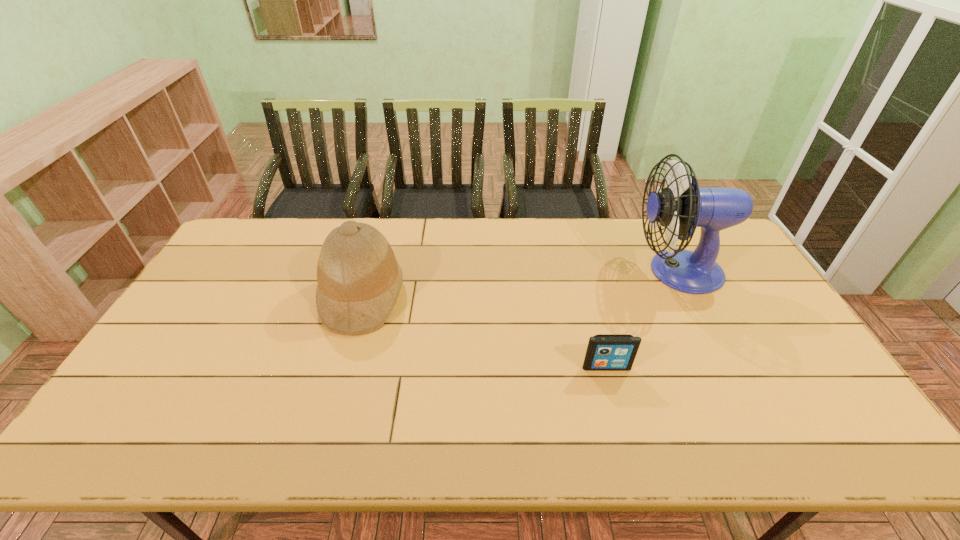
This screenshot has height=540, width=960. I want to click on free spot between the tallest object and the nearest object, so click(x=642, y=319).

Find the location of a particular element. vacant region between the hat and the nearest object is located at coordinates (485, 332).

Where is `free space between the hat and the second object from right to left`? This screenshot has width=960, height=540. free space between the hat and the second object from right to left is located at coordinates (485, 332).

Locate an element on the screen. The image size is (960, 540). vacant space that is in between the nearest object and the fan is located at coordinates (642, 319).

Where is `free space that is in between the second object from right to left and the leftmost object`? The image size is (960, 540). free space that is in between the second object from right to left and the leftmost object is located at coordinates (485, 332).

The image size is (960, 540). In order to click on free space between the nearest object and the fan in this screenshot , I will do `click(642, 319)`.

The width and height of the screenshot is (960, 540). I want to click on free space between the tallest object and the second tallest object, so click(520, 284).

What are the coordinates of `free point between the tallest object and the second shortest object` in the screenshot? It's located at (520, 284).

Find the location of a particular element. This screenshot has width=960, height=540. vacant space in between the second object from right to left and the second shortest object is located at coordinates (x=485, y=332).

This screenshot has height=540, width=960. I want to click on object that stands as the second closest to the fan, so click(359, 279).